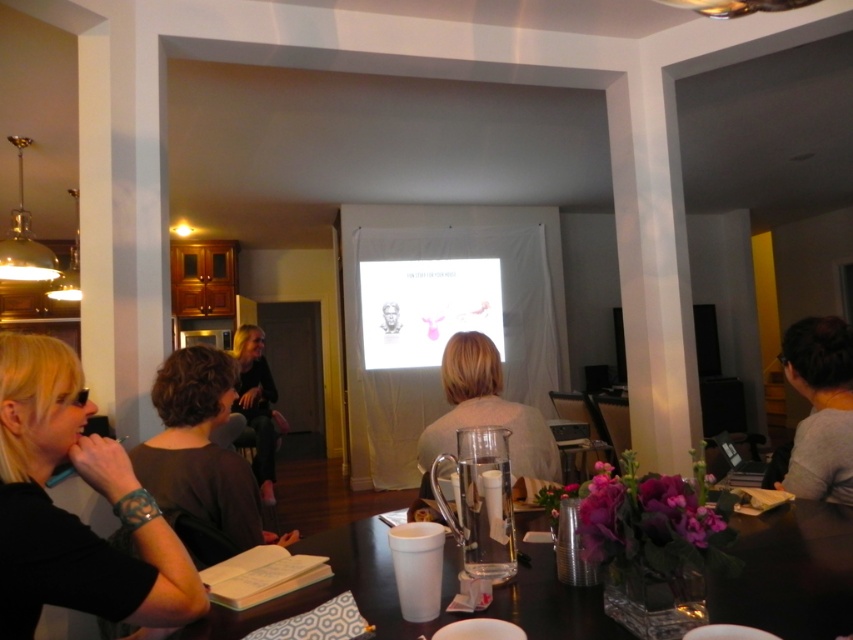
Question: Which point is farther to the camera?

Choices:
 (A) (366, 285)
 (B) (0, 605)

Answer: (A)

Question: Does dark brown hair at lower left come in front of gray matte shirt at lower right?

Choices:
 (A) yes
 (B) no

Answer: (A)

Question: Which object appears farthest from the camera in this image?

Choices:
 (A) black matte hair at left
 (B) dark brown hair at lower left
 (C) white matte projection screen at center

Answer: (C)

Question: Is the position of black matte hair at left more distant than that of light beige sweater at center?

Choices:
 (A) yes
 (B) no

Answer: (B)

Question: Which point is farther from the camera taking this photo?

Choices:
 (A) (253, 458)
 (B) (752, 548)
 (C) (120, 579)
 (D) (381, 330)

Answer: (D)

Question: Can you confirm if translucent glass table at center is positioned below dark brown hair at lower left?

Choices:
 (A) yes
 (B) no

Answer: (A)